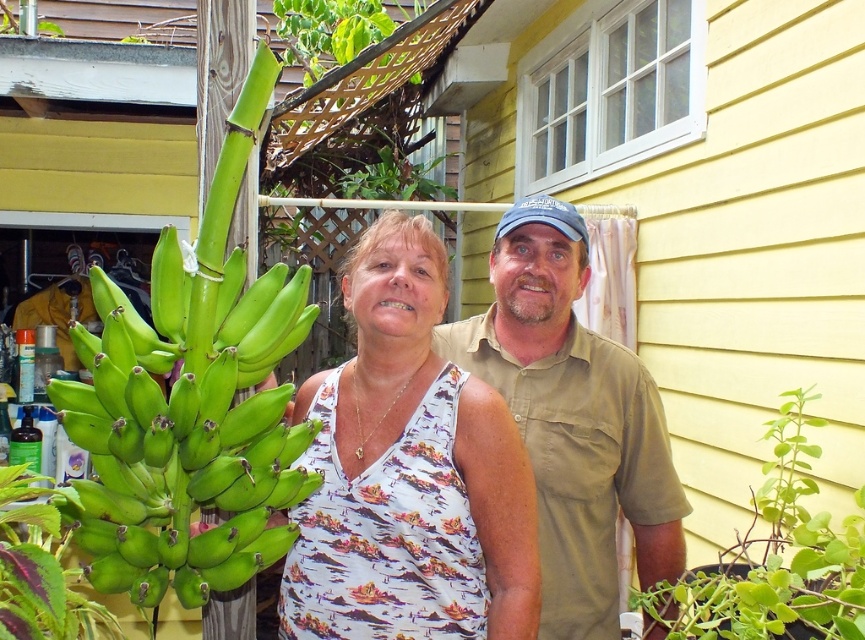
Is white floral tank top at center below green matte bananas at left?

Yes.

Between point (394, 260) and point (101, 360), which one is positioned behind?

The point (394, 260) is more distant.

At what (x,y) coordinates should I click in order to perform the action: click on white floral tank top at center. Please return your answer as a coordinate pair (x, y). Looking at the image, I should click on (408, 472).

Is green matte bananas at left taller than khaki cotton shirt at center?

No, green matte bananas at left is not taller than khaki cotton shirt at center.

Does green matte bananas at left have a smaller size compared to khaki cotton shirt at center?

Yes, green matte bananas at left is smaller than khaki cotton shirt at center.

Is point (187, 428) positioned after point (580, 408)?

No.

The height and width of the screenshot is (640, 865). What are the coordinates of `green matte bananas at left` in the screenshot? It's located at (177, 468).

Which is more to the left, white floral tank top at center or khaki cotton shirt at center?

Positioned to the left is white floral tank top at center.

Between point (477, 490) and point (660, 477), which one is positioned in front?

Point (477, 490) is more forward.

Which is behind, point (477, 394) or point (585, 481)?

The point (585, 481) is more distant.

The height and width of the screenshot is (640, 865). I want to click on white floral tank top at center, so click(408, 472).